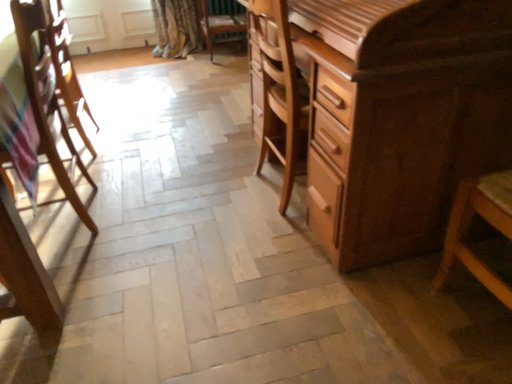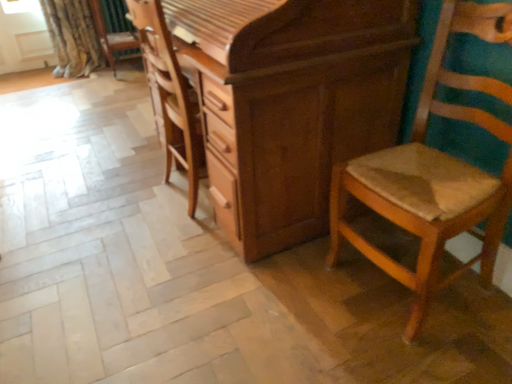
Question: How did the camera likely rotate when shooting the video?

Choices:
 (A) rotated right
 (B) rotated left

Answer: (A)